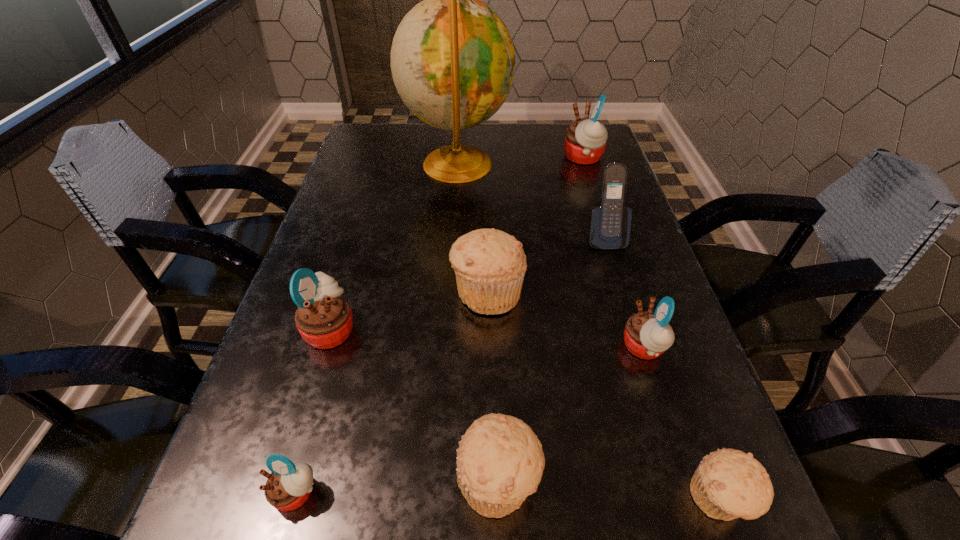
Locate an element on the screen. Image resolution: width=960 pixels, height=540 pixels. vacant space that satisfies the following two spatial constraints: 1. on the front-facing side of the third smallest pink muffin; 2. on the back side of the second biggest beige muffin is located at coordinates (285, 480).